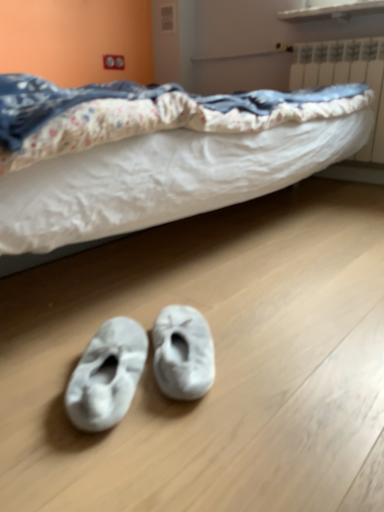
At what (x,y) coordinates should I click in order to perform the action: click on blank space to the left of white fuzzy slippers at lower center, the 1th footwear positioned from the left. Please return your answer as a coordinate pair (x, y). Looking at the image, I should click on (35, 374).